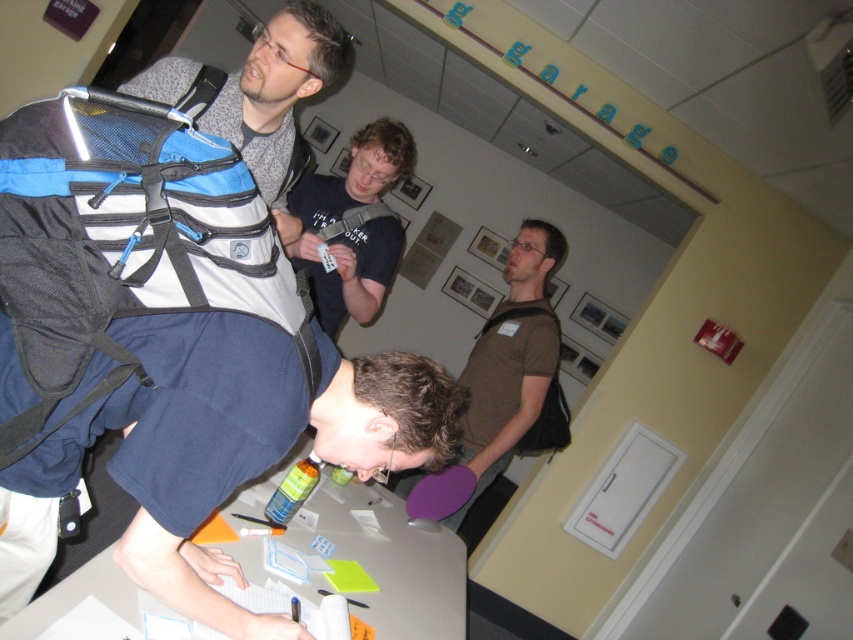
Is smooth gray table at lower center positioned before dark brown t-shirt at center?

Yes, it is.

Is smooth gray table at lower center to the left of dark brown t-shirt at center from the viewer's perspective?

Indeed, smooth gray table at lower center is positioned on the left side of dark brown t-shirt at center.

Is point (415, 595) positioned before point (363, 140)?

Yes, it is.

The height and width of the screenshot is (640, 853). I want to click on smooth gray table at lower center, so click(392, 563).

Can you confirm if blue and white mesh backpack at left is thinner than smooth gray table at lower center?

Yes.

What do you see at coordinates (126, 240) in the screenshot?
I see `blue and white mesh backpack at left` at bounding box center [126, 240].

Is point (172, 186) positioned before point (48, 614)?

Yes.

The height and width of the screenshot is (640, 853). In order to click on blue and white mesh backpack at left in this screenshot , I will do `click(126, 240)`.

Between point (180, 202) and point (488, 365), which one is positioned behind?

The point (488, 365) is more distant.

Does blue and white mesh backpack at left have a lesser width compared to brown matte shirt at center?

Yes.

Who is more forward, (54, 125) or (479, 337)?

Point (54, 125) is in front.

The image size is (853, 640). Identify the location of blue and white mesh backpack at left. (126, 240).